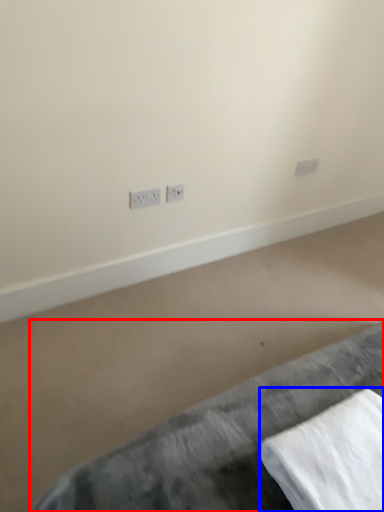
Question: Which of the following is the closest to the observer, furniture (highlighted by a red box) or linen (highlighted by a blue box)?

Choices:
 (A) furniture
 (B) linen

Answer: (A)